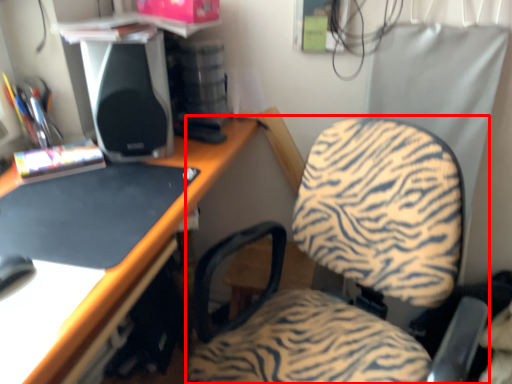
Question: From the image's perspective, what is the correct spatial relationship of chair (annotated by the red box) in relation to speaker?

Choices:
 (A) below
 (B) above

Answer: (A)